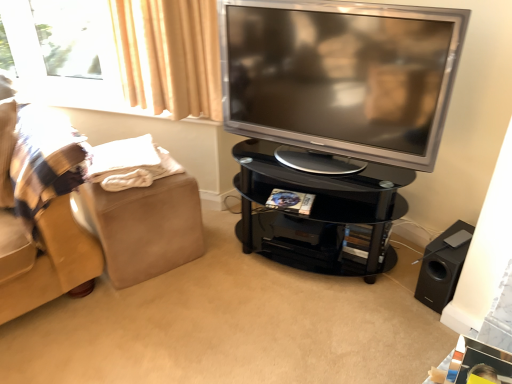
Find the location of a particular element. free space to the left of black matte speaker at lower right is located at coordinates (393, 291).